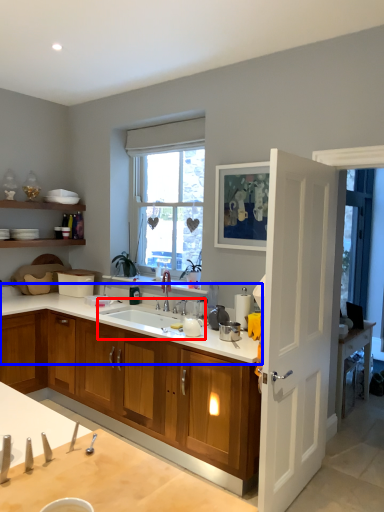
Question: Among these objects, which one is nearest to the camera, sink (highlighted by a red box) or countertop (highlighted by a blue box)?

Choices:
 (A) sink
 (B) countertop

Answer: (B)